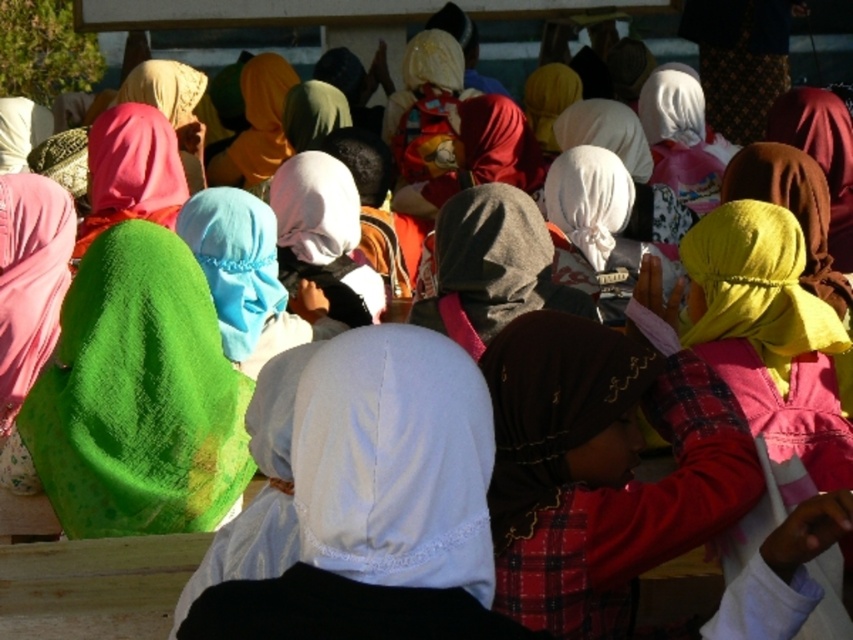
You are a photographer trying to capture the vibrant green textured scarf at center left in the image. The camera is currently focused on the point at coordinate point (136,387). Is the green textured scarf at center left in focus?

Yes, the green textured scarf at center left is in focus because it is located exactly at the point (136,387) where the camera is focused.